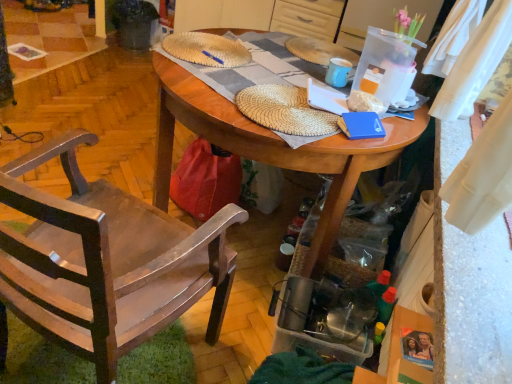
Identify the location of vacant space to the left of blue plastic pen at center. The height and width of the screenshot is (384, 512). click(x=179, y=46).